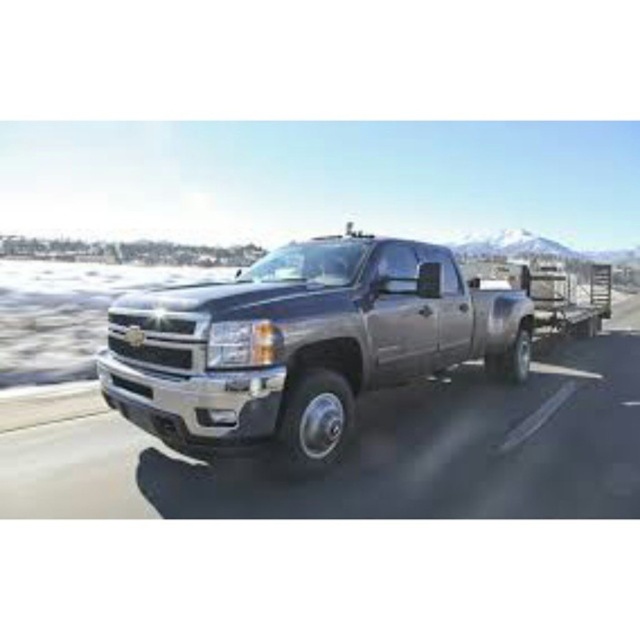
Question: Which of the following is the farthest from the observer?

Choices:
 (A) 198,456
 (B) 161,497

Answer: (A)

Question: Can you confirm if metallic gray truck at center is thinner than satin metallic pickup truck at center?

Choices:
 (A) no
 (B) yes

Answer: (A)

Question: Can you confirm if metallic gray truck at center is wider than satin metallic pickup truck at center?

Choices:
 (A) yes
 (B) no

Answer: (A)

Question: Which point is closer to the camera?

Choices:
 (A) (310, 248)
 (B) (358, 515)

Answer: (B)

Question: Can you confirm if metallic gray truck at center is positioned to the right of satin metallic pickup truck at center?

Choices:
 (A) yes
 (B) no

Answer: (A)